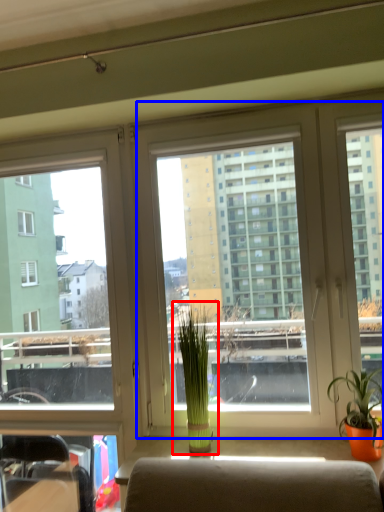
Question: Among these objects, which one is nearest to the camera, houseplant (highlighted by a red box) or window screen (highlighted by a blue box)?

Choices:
 (A) houseplant
 (B) window screen

Answer: (B)